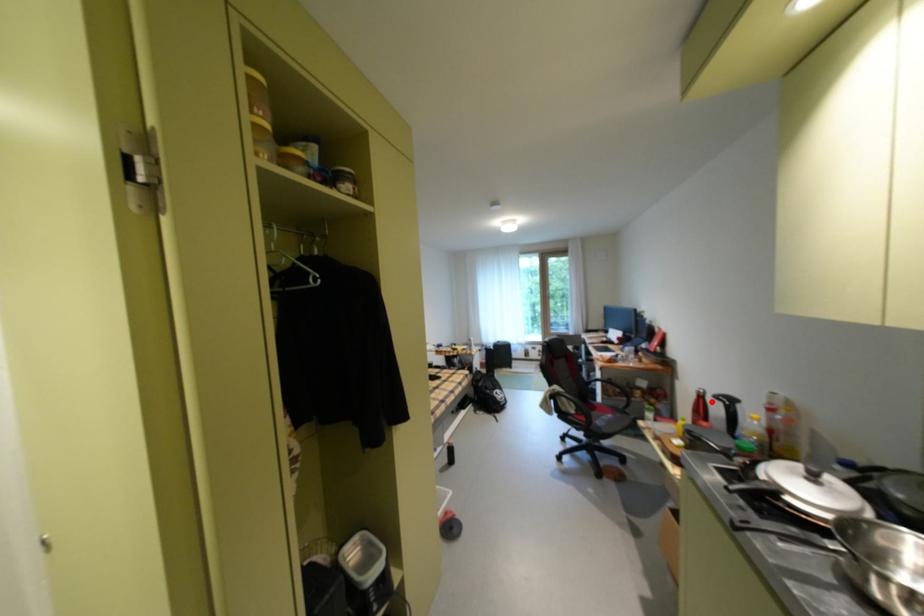
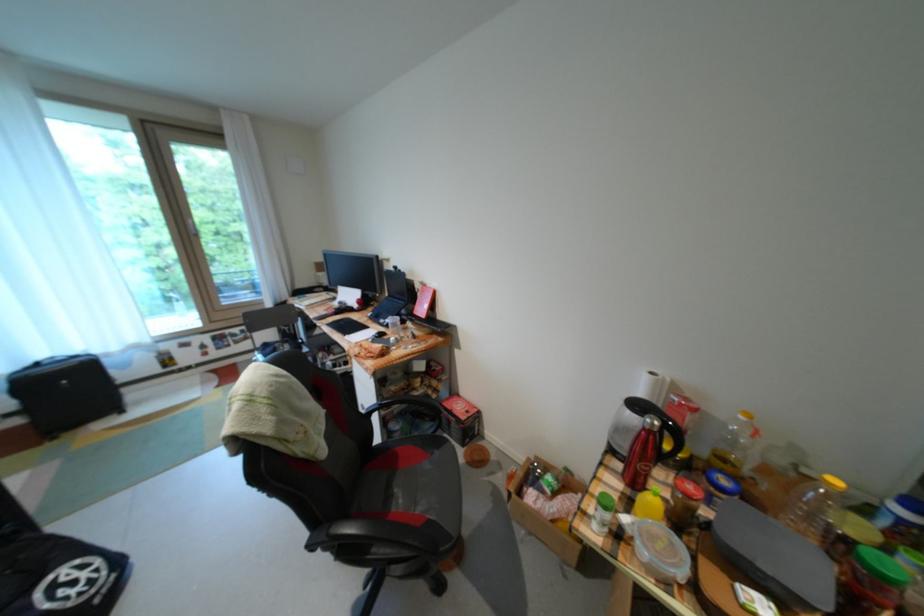
Find the pixel in the second image that matches the highlighted location in the first image.

(662, 438)